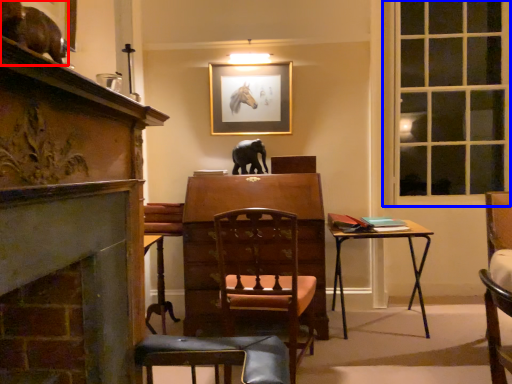
Question: Among these objects, which one is farthest to the camera, animal (highlighted by a red box) or window (highlighted by a blue box)?

Choices:
 (A) animal
 (B) window

Answer: (B)